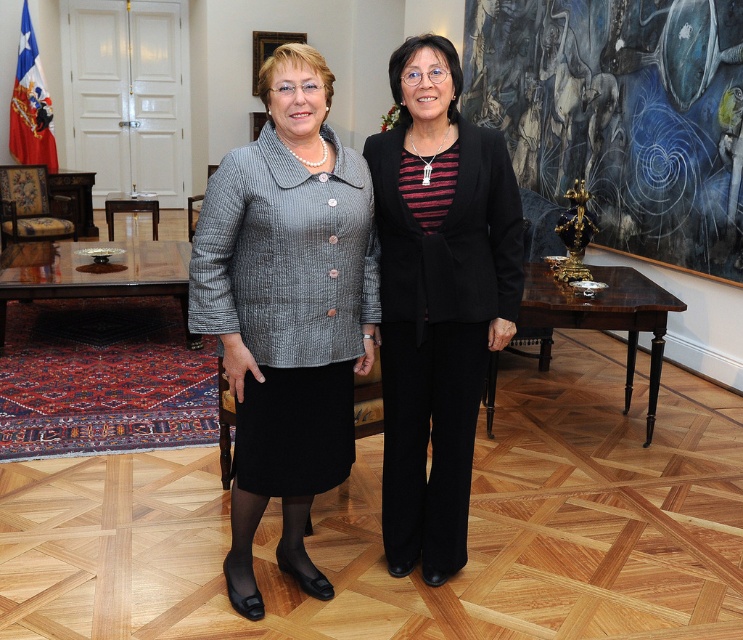
You are standing in the room and want to place a small plant at point [288,310]. Is this point on the matte gray blazer at center?

Yes, the point [288,310] is on the matte gray blazer at center according to the description.

You are standing in the room and want to place a new painting on the wall. The painting is 1 meter wide and needs to be centered at the same 2D location as the metallic gold sculpture at right. What are the coordinates of the center of the painting?

The center of the painting should be placed at coordinates (620,115) to match the 2D location of the metallic gold sculpture at right.

From the picture: You are an interior designer assessing the layout of this formal office space. You notice the matte gray blazer at center and the black textured pants at center. Which of these two items has a greater width when viewed from the front?

The matte gray blazer at center has a larger width than the black textured pants at center.